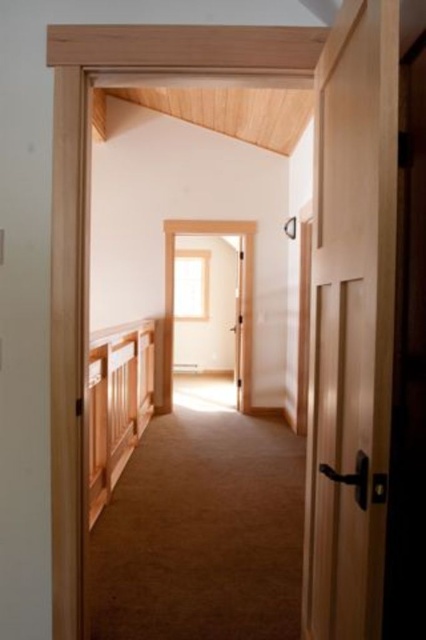
Question: Which point is closer to the camera taking this photo?

Choices:
 (A) (98, 504)
 (B) (316, 216)

Answer: (B)

Question: Does light brown wooden door at right come in front of wooden textured rail at left?

Choices:
 (A) yes
 (B) no

Answer: (A)

Question: Which point appears closest to the camera in this image?

Choices:
 (A) (348, 20)
 (B) (89, 496)

Answer: (A)

Question: Does light brown wooden door at right lie behind wooden textured rail at left?

Choices:
 (A) no
 (B) yes

Answer: (A)

Question: Where is light brown wooden door at right located in relation to wooden textured rail at left in the image?

Choices:
 (A) below
 (B) above

Answer: (B)